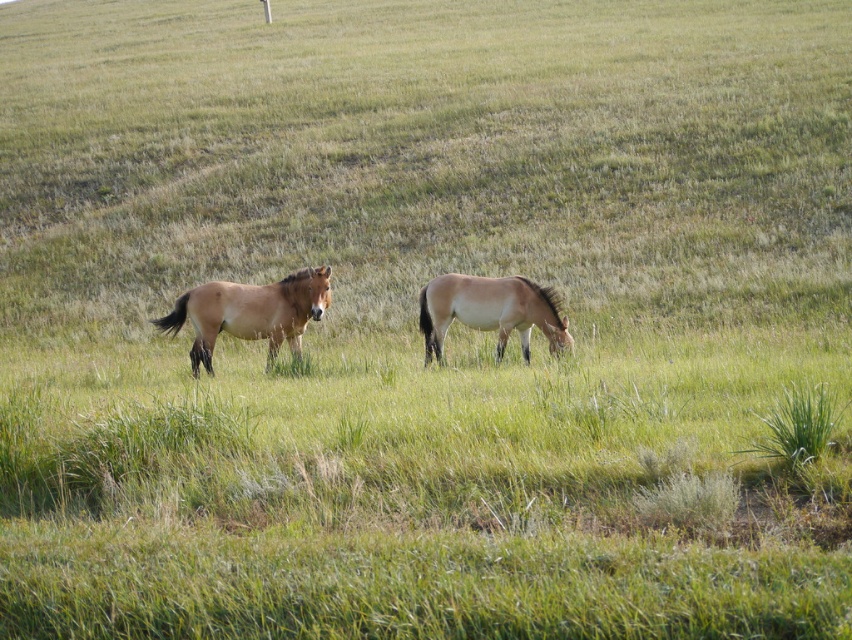
Question: Can you confirm if brown matte horse at center is positioned above light brown glossy horse at center?

Choices:
 (A) yes
 (B) no

Answer: (B)

Question: Which object appears farthest from the camera in this image?

Choices:
 (A) brown matte horse at center
 (B) light brown glossy horse at center

Answer: (B)

Question: Considering the relative positions of brown matte horse at center and light brown glossy horse at center in the image provided, where is brown matte horse at center located with respect to light brown glossy horse at center?

Choices:
 (A) below
 (B) above

Answer: (A)

Question: Which object is farther from the camera taking this photo?

Choices:
 (A) brown matte horse at center
 (B) light brown glossy horse at center

Answer: (B)

Question: Is brown matte horse at center above light brown glossy horse at center?

Choices:
 (A) yes
 (B) no

Answer: (B)